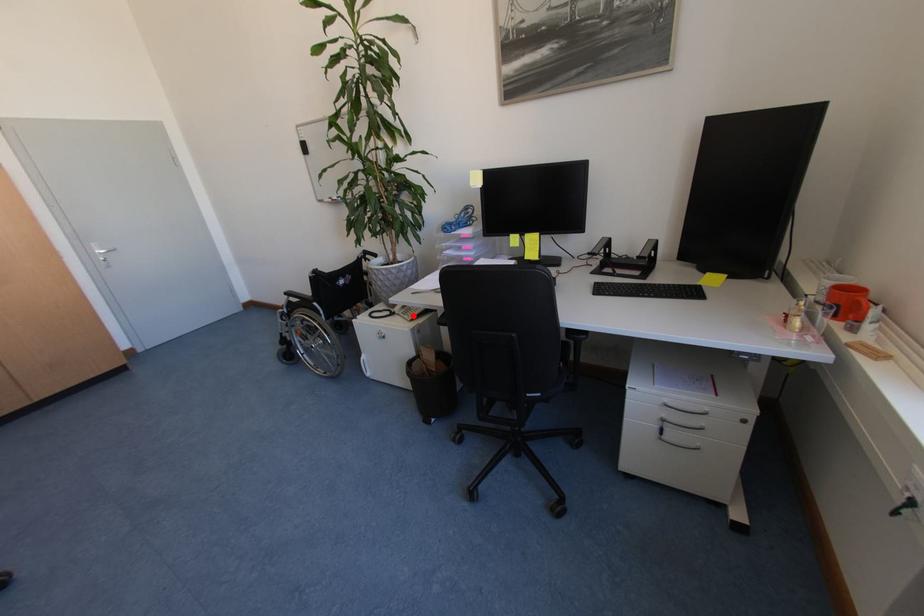
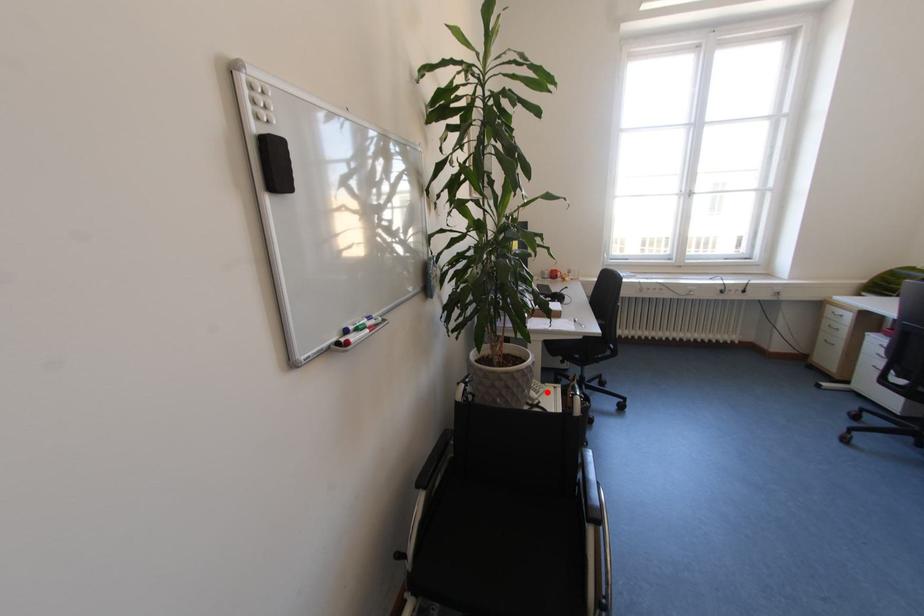
I am providing you with two images of the same scene from different viewpoints. A red point is marked on the first image and another point is marked on the second image. Are the points marked in image1 and image2 representing the same 3D position?

Yes